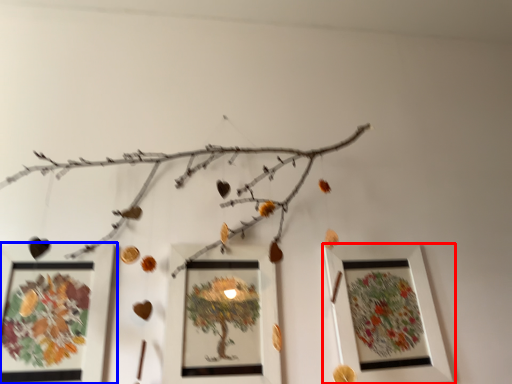
Question: Which object appears closest to the camera in this image, picture frame (highlighted by a red box) or picture frame (highlighted by a blue box)?

Choices:
 (A) picture frame
 (B) picture frame

Answer: (B)